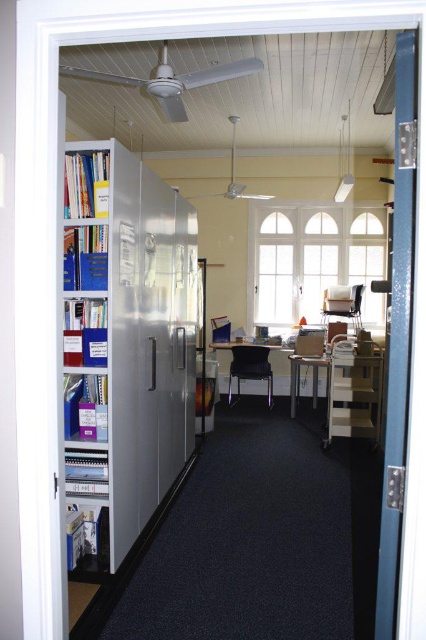
You are a maintenance worker needing to replace a light bulb in the hallway. The nearest light is between the metallic gray bookcase at left and the ceiling fan. Can you reach it if your ladder is 2 meters long?

The distance between the metallic gray bookcase at left and the ceiling fan is 2.08 meters. Since the ladder is only 2 meters long, it is 8 centimeters too short to reach the light between them.